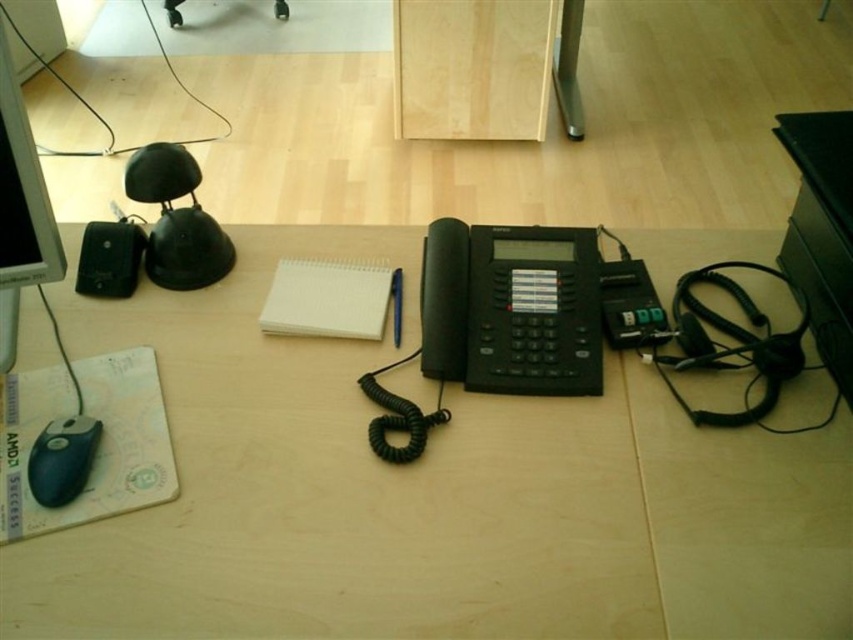
You are organizing items on your desk and need to place a new keyboard. The keyboard requires 30 cm of space to the right of the matte black telephone at center. Is there enough space on the desk for the keyboard?

The matte black telephone at center is located at point (428, 496). Since the desk dimensions aren not provided, it is impossible to determine if there is enough space for the keyboard.

From the picture: You are organizing items on your desk and need to place a new item between the matte black telephone at center and the black rubberized lamp at left. Is there enough space between them to fit a 10 cm wide notebook?

The matte black telephone at center is positioned on the right side of the black rubberized lamp at left, meaning they are already adjacent to each other. Therefore, there is no space between them to fit a 10 cm wide notebook.

You are organizing items on the desk and want to place a new item between the computer mouse on the left side and the black telephone in the center. The coordinates for the black rubberized lamp at left are given as point (x=177, y=220). Can you confirm if this point is located between the computer mouse on the left side and the black telephone in the center?

The point (x=177, y=220) indicates the black rubberized lamp at left, which is located to the left of the computer mouse on the left side. Therefore, it is not between the computer mouse on the left side and the black telephone in the center.